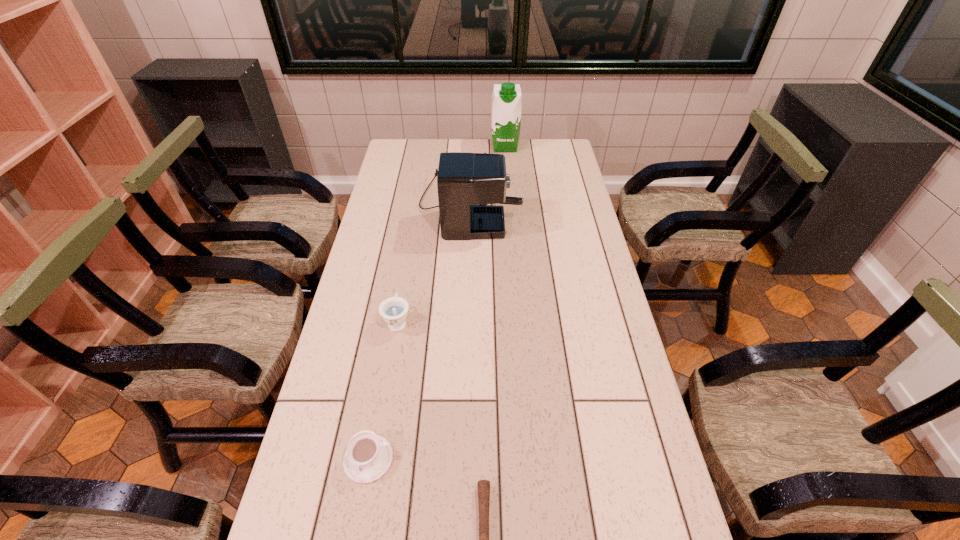
Identify the location of vacant space located 0.230m on the side of the third farthest object with the handle. (409, 256).

Image resolution: width=960 pixels, height=540 pixels. What are the coordinates of `free space located on the side of the third farthest object with the handle` in the screenshot? It's located at (412, 239).

At what (x,y) coordinates should I click in order to perform the action: click on vacant space located on the handle side of the nearer teacup. Please return your answer as a coordinate pair (x, y). This screenshot has height=540, width=960. Looking at the image, I should click on (357, 519).

Identify the location of object that is at the far edge. This screenshot has height=540, width=960. (506, 98).

Identify the location of vacant space at the far edge. This screenshot has width=960, height=540. coord(432,140).

The width and height of the screenshot is (960, 540). I want to click on vacant space at the left edge of the desktop, so (281, 538).

Find the location of a particular element. Image resolution: width=960 pixels, height=540 pixels. free region at the right edge of the desktop is located at coordinates (623, 341).

Where is `unoccupied area between the nearer teacup and the second tallest object`? unoccupied area between the nearer teacup and the second tallest object is located at coordinates (419, 331).

The image size is (960, 540). Find the location of `free space between the nearer teacup and the farthest object`. free space between the nearer teacup and the farthest object is located at coordinates (437, 303).

Select which object is the fourth closest to the second farthest object. Please provide its 2D coordinates. Your answer should be formatted as a tuple, i.e. [(x, y)], where the tuple contains the x and y coordinates of a point satisfying the conditions above.

[(483, 485)]